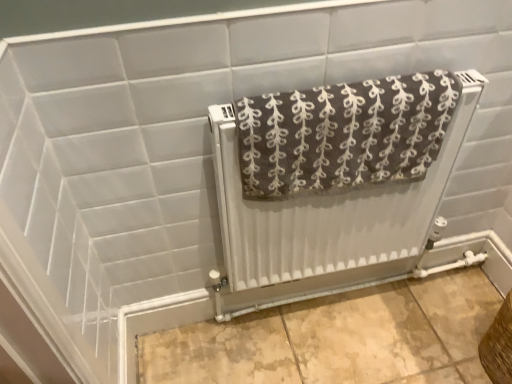
Locate an element on the screen. brown woven basket at lower right is located at coordinates (498, 345).

The height and width of the screenshot is (384, 512). Identify the location of brown textured towel at center. (343, 134).

Would you say brown textured towel at center is inside or outside brown woven basket at lower right?

brown textured towel at center is outside brown woven basket at lower right.

Is point (337, 143) closer to viewer compared to point (501, 338)?

That is True.

From the image's perspective, does brown textured towel at center appear lower than brown woven basket at lower right?

No, from the image's perspective, brown textured towel at center is not below brown woven basket at lower right.

Looking at their sizes, would you say brown textured towel at center is wider or thinner than brown woven basket at lower right?

brown textured towel at center is thinner than brown woven basket at lower right.

In the scene shown: Is the depth of brown textured towel at center less than that of white textured radiator at center?

That is True.

Is brown textured towel at center at the right side of white textured radiator at center?

No, brown textured towel at center is not to the right of white textured radiator at center.

Is brown textured towel at center aimed at white textured radiator at center?

Yes, brown textured towel at center is turned towards white textured radiator at center.

Looking at this image, would you say brown textured towel at center is a long distance from white textured radiator at center?

No, there isn't a large distance between brown textured towel at center and white textured radiator at center.

You are a GUI agent. You are given a task and a screenshot of the screen. Output one action in this format:
    pyautogui.click(x=<x>, y=<y>)
    Task: Click on the towel in front of the white textured radiator at center
    
    Given the screenshot: What is the action you would take?
    pyautogui.click(x=343, y=134)

Considering the sizes of white textured radiator at center and brown textured towel at center in the image, is white textured radiator at center bigger or smaller than brown textured towel at center?

white textured radiator at center is bigger than brown textured towel at center.

Is white textured radiator at center far from brown textured towel at center?

They are positioned close to each other.

Consider the image. Would you say brown textured towel at center is part of white textured radiator at center's contents?

Yes, white textured radiator at center is surrounding brown textured towel at center.

From the picture: Can you tell me how much white textured radiator at center and brown woven basket at lower right differ in facing direction?

The angular difference between white textured radiator at center and brown woven basket at lower right is 89.8 degrees.

Is white textured radiator at center not inside brown woven basket at lower right?

Yes, white textured radiator at center is located beyond the bounds of brown woven basket at lower right.

From the image's perspective, does white textured radiator at center appear lower than brown woven basket at lower right?

No, from the image's perspective, white textured radiator at center is not below brown woven basket at lower right.

I want to click on radiator in front of the brown woven basket at lower right, so click(x=324, y=224).

Is brown woven basket at lower right bigger than white textured radiator at center?

No.

Visually, is brown woven basket at lower right positioned to the left or to the right of white textured radiator at center?

brown woven basket at lower right is positioned on white textured radiator at center's right side.

Can you see brown woven basket at lower right touching white textured radiator at center?

There is a gap between brown woven basket at lower right and white textured radiator at center.

Is the position of brown woven basket at lower right less distant than that of white textured radiator at center?

No, it is not.

Which object is closer to the camera, brown woven basket at lower right or brown textured towel at center?

brown textured towel at center is in front.

How many degrees apart are the facing directions of brown woven basket at lower right and brown textured towel at center?

There is a 89.8-degree angle between the facing directions of brown woven basket at lower right and brown textured towel at center.

From the picture: Which object is positioned more to the right, brown woven basket at lower right or brown textured towel at center?

brown woven basket at lower right is more to the right.

Identify the location of towel located above the brown woven basket at lower right (from a real-world perspective). (343, 134).

Image resolution: width=512 pixels, height=384 pixels. Identify the location of radiator behind the brown textured towel at center. (324, 224).

Based on their spatial positions, is white textured radiator at center or brown textured towel at center closer to brown woven basket at lower right?

Based on the image, white textured radiator at center appears to be nearer to brown woven basket at lower right.

Looking at the image, which one is located further to brown textured towel at center, white textured radiator at center or brown woven basket at lower right?

brown woven basket at lower right is further to brown textured towel at center.

Considering their positions, is brown textured towel at center positioned further to white textured radiator at center than brown woven basket at lower right?

brown woven basket at lower right is positioned further to the anchor white textured radiator at center.

From the image, which object appears to be farther from brown woven basket at lower right, brown textured towel at center or white textured radiator at center?

brown textured towel at center lies further to brown woven basket at lower right than the other object.

Looking at the image, which one is located closer to brown textured towel at center, brown woven basket at lower right or white textured radiator at center?

white textured radiator at center lies closer to brown textured towel at center than the other object.

From the image, which object appears to be farther from white textured radiator at center, brown woven basket at lower right or brown textured towel at center?

brown woven basket at lower right lies further to white textured radiator at center than the other object.

I want to click on radiator between brown textured towel at center and brown woven basket at lower right, so click(324, 224).